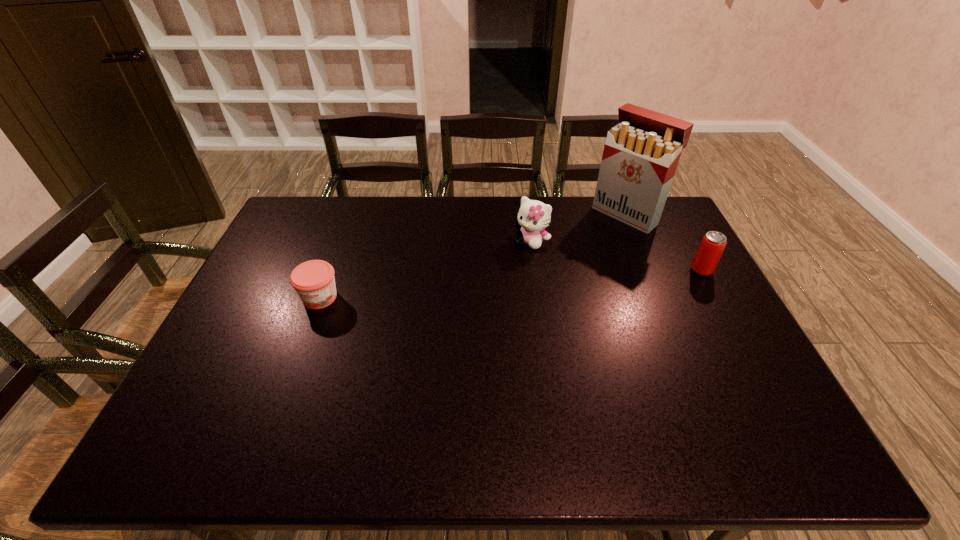
The width and height of the screenshot is (960, 540). Find the location of `unoccupied position between the third object from left to right and the leftmost object`. unoccupied position between the third object from left to right and the leftmost object is located at coordinates (473, 256).

This screenshot has width=960, height=540. I want to click on unoccupied position between the shortest object and the cigarette case, so click(473, 256).

Identify the location of free point between the third object from left to right and the second tallest object. (579, 227).

Find the location of a particular element. This screenshot has width=960, height=540. vacant region between the second object from left to right and the rightmost object is located at coordinates (616, 255).

I want to click on free point between the second tallest object and the third farthest object, so 616,255.

At what (x,y) coordinates should I click in order to perform the action: click on object that is the second closest to the jam. Please return your answer as a coordinate pair (x, y). Looking at the image, I should click on (641, 154).

Point out which object is positioned as the nearest to the second shortest object. Please provide its 2D coordinates. Your answer should be formatted as a tuple, i.e. [(x, y)], where the tuple contains the x and y coordinates of a point satisfying the conditions above.

[(641, 154)]